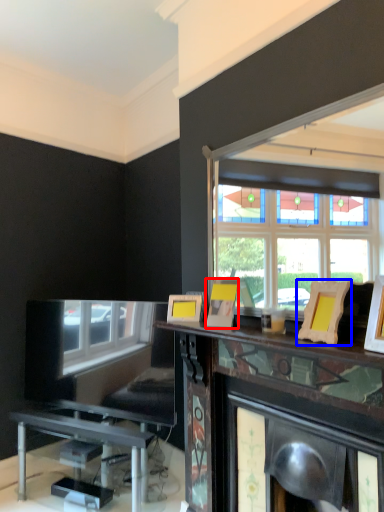
Question: Which object is closer to the camera taking this photo, picture frame (highlighted by a red box) or picture frame (highlighted by a blue box)?

Choices:
 (A) picture frame
 (B) picture frame

Answer: (B)